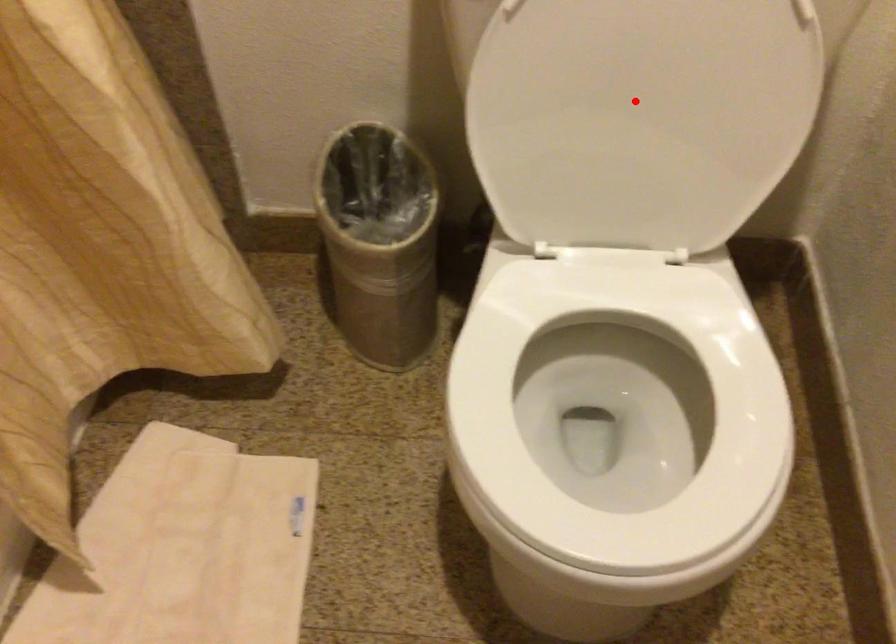
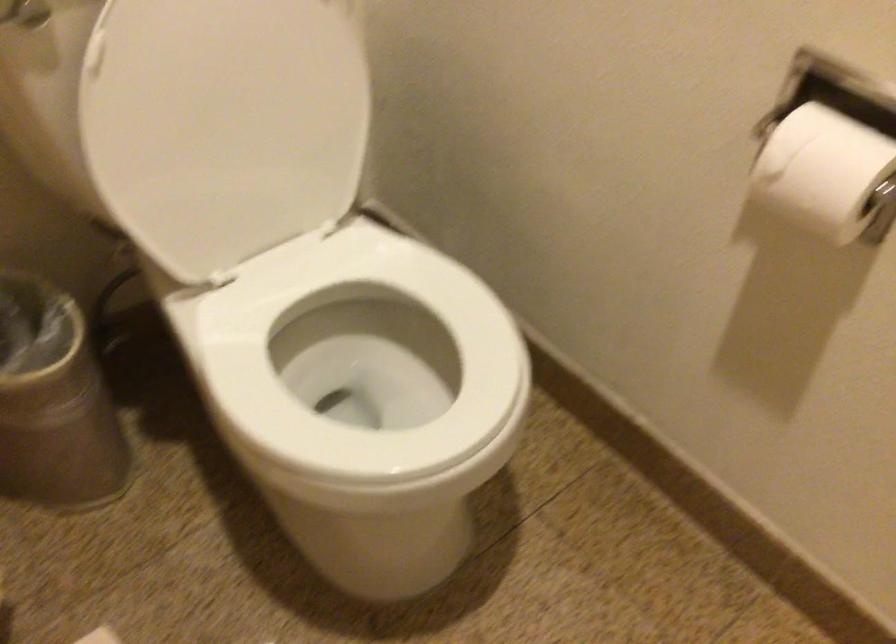
The point at the highlighted location is marked in the first image. Where is the corresponding point in the second image?

(239, 114)